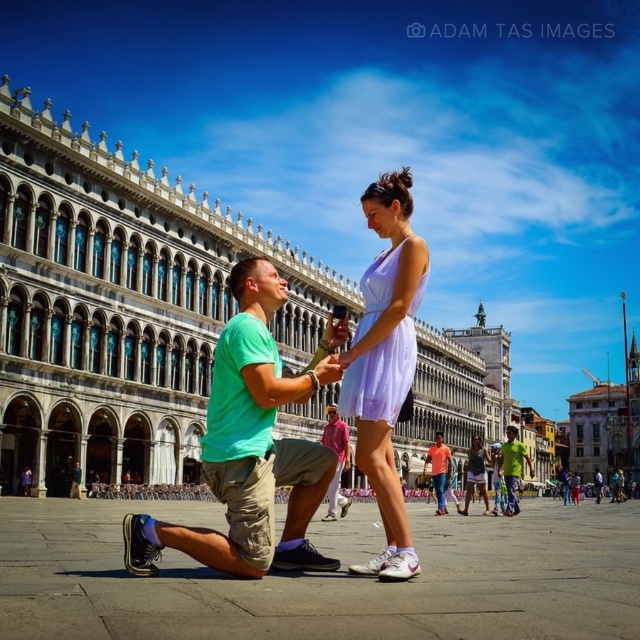
You are a photographer positioned in the square and want to capture a photo of both the matte purple dress at center and the orange cotton shirt at center. Based on their positions, which one should you focus on first to ensure both are in the frame?

The matte purple dress at center is to the right of the orange cotton shirt at center, so you should focus on the orange cotton shirt at center first to ensure both are in the frame.